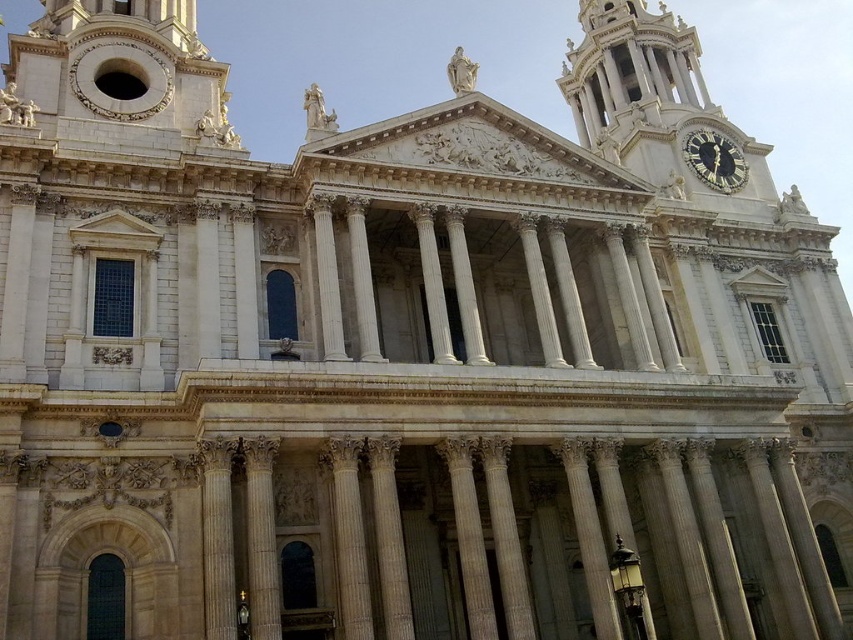
Who is more distant from viewer, [347,636] or [701,134]?

Positioned behind is point [701,134].

Can you confirm if white marble column at center is thinner than gold metallic clock at upper right?

Yes.

Locate an element on the screen. This screenshot has height=640, width=853. white marble column at center is located at coordinates (349, 538).